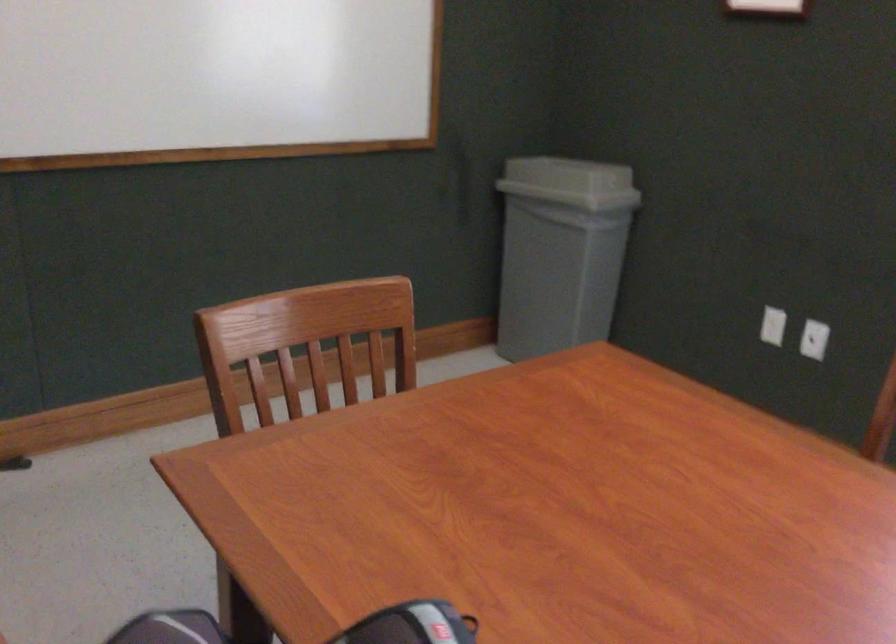
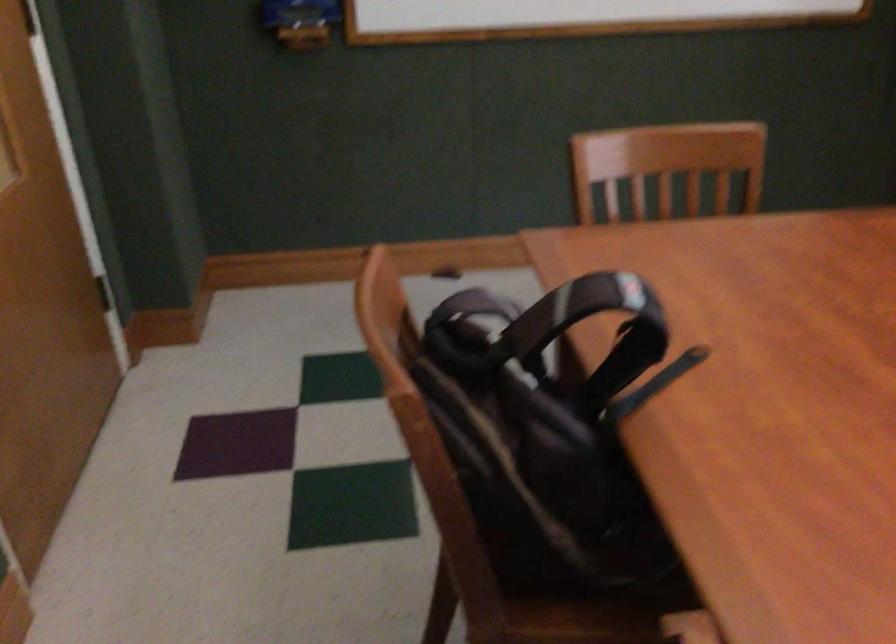
Question: Based on the continuous images, in which direction is the camera rotating? Reply with the corresponding letter.

Choices:
 (A) Left
 (B) Right
 (C) Up
 (D) Down

Answer: (A)